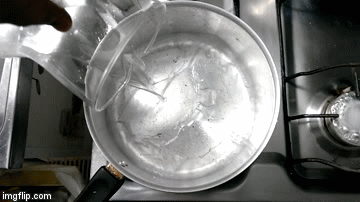
I want to click on edge of burner, so click(109, 14).